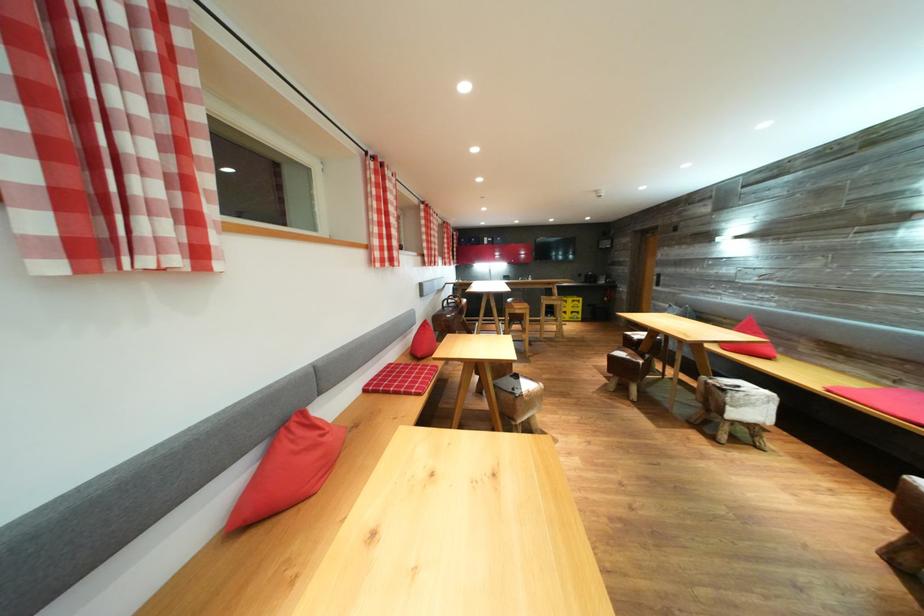
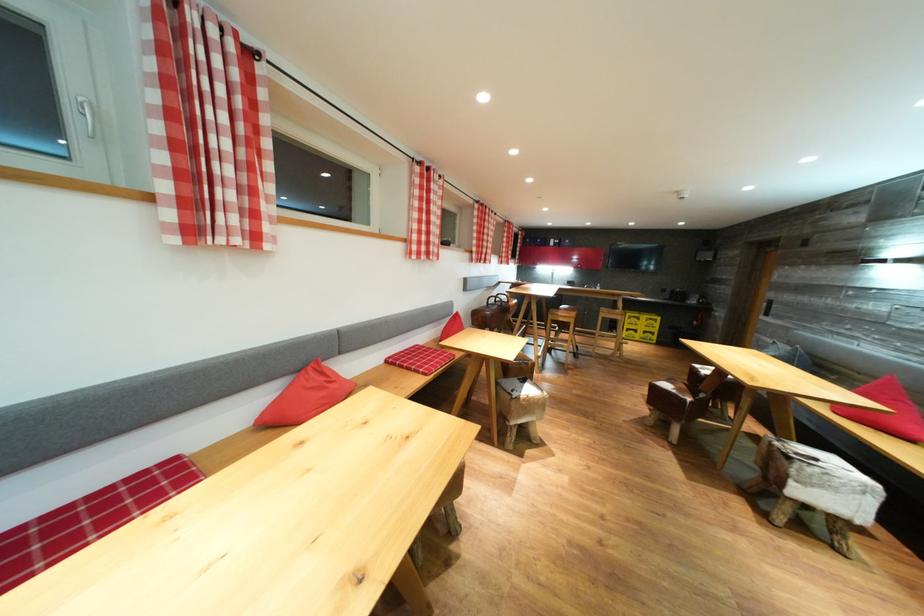
Locate, in the second image, the point that corresponds to (x=525, y=317) in the first image.

(567, 325)